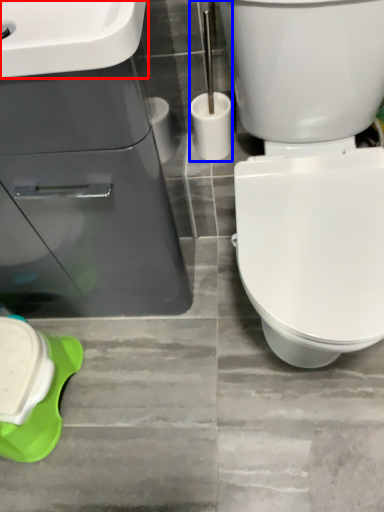
Question: Which object appears closest to the camera in this image, sink (highlighted by a red box) or brush (highlighted by a blue box)?

Choices:
 (A) sink
 (B) brush

Answer: (A)